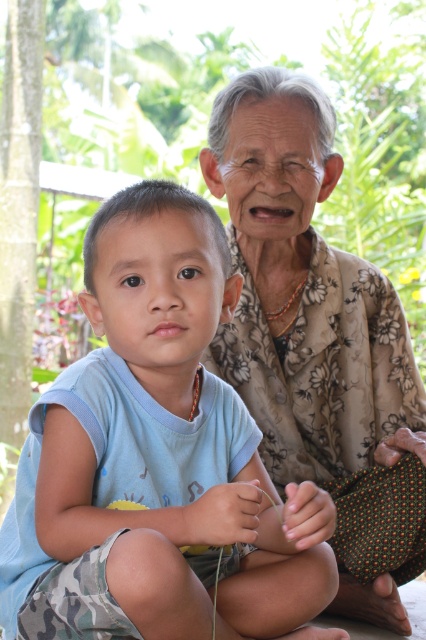
Question: Does blue cotton shirt at center appear over floral-patterned fabric at upper right?

Choices:
 (A) no
 (B) yes

Answer: (A)

Question: Which point is farther to the camera?

Choices:
 (A) blue cotton shirt at center
 (B) floral-patterned fabric at upper right

Answer: (B)

Question: Is blue cotton shirt at center to the right of floral-patterned fabric at upper right from the viewer's perspective?

Choices:
 (A) no
 (B) yes

Answer: (A)

Question: Which point is farther to the camera?

Choices:
 (A) (230, 179)
 (B) (63, 502)

Answer: (A)

Question: Does blue cotton shirt at center lie in front of floral-patterned fabric at upper right?

Choices:
 (A) yes
 (B) no

Answer: (A)

Question: Which of the following is the closest to the observer?

Choices:
 (A) blue cotton shirt at center
 (B) floral-patterned fabric at upper right

Answer: (A)